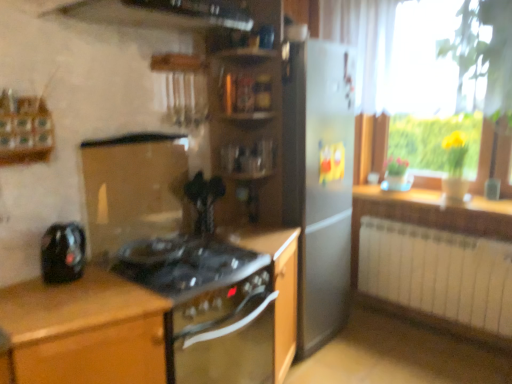
Identify the location of free space in front of black glossy kettle at left. (44, 303).